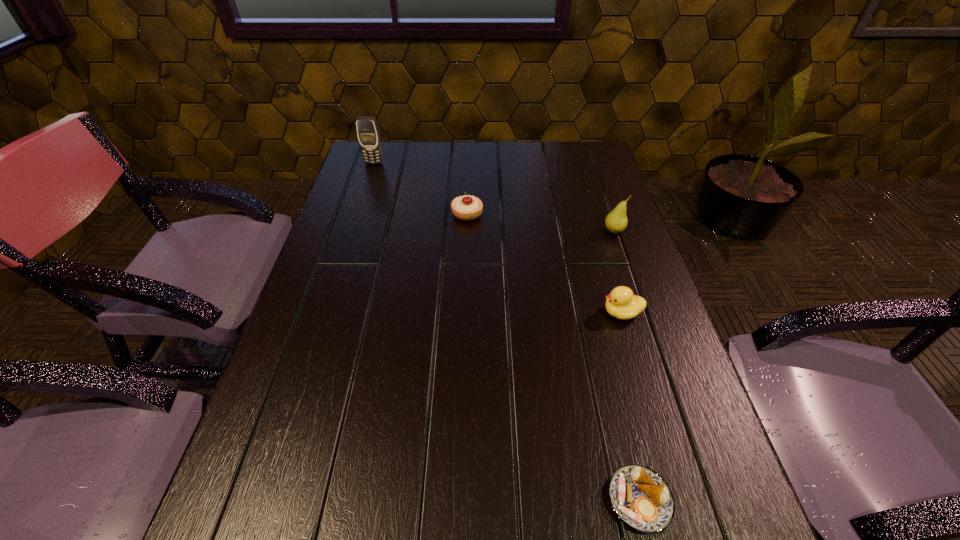
Where is `free space between the farthest object and the second nearest object`? The height and width of the screenshot is (540, 960). free space between the farthest object and the second nearest object is located at coordinates (497, 238).

At what (x,y) coordinates should I click in order to perform the action: click on free area in between the third farthest object and the fourth farthest object. Please return your answer as a coordinate pair (x, y). The image size is (960, 540). Looking at the image, I should click on (617, 272).

Where is `empty space that is in between the pear and the fourth farthest object`? empty space that is in between the pear and the fourth farthest object is located at coordinates (617, 272).

What are the coordinates of `empty location between the fourth shortest object and the shorter pastry` in the screenshot? It's located at (627, 366).

Identify the location of free spot between the farthest object and the fourth farthest object. (497, 238).

This screenshot has width=960, height=540. Identify the location of object that is the fourth closest to the duckling. (368, 134).

I want to click on object identified as the second closest to the fourth nearest object, so click(x=616, y=221).

The height and width of the screenshot is (540, 960). Find the location of `vacant area in the image that satisfies the following two spatial constraints: 1. on the front face of the tallest object; 2. on the left side of the farther pastry`. vacant area in the image that satisfies the following two spatial constraints: 1. on the front face of the tallest object; 2. on the left side of the farther pastry is located at coordinates (357, 214).

Locate an element on the screen. The height and width of the screenshot is (540, 960). blank space that satisfies the following two spatial constraints: 1. on the front face of the tallest object; 2. on the left side of the pear is located at coordinates (351, 231).

Find the location of a particular element. This screenshot has height=540, width=960. free space that satisfies the following two spatial constraints: 1. on the front side of the second shortest object; 2. on the right side of the third farthest object is located at coordinates (467, 231).